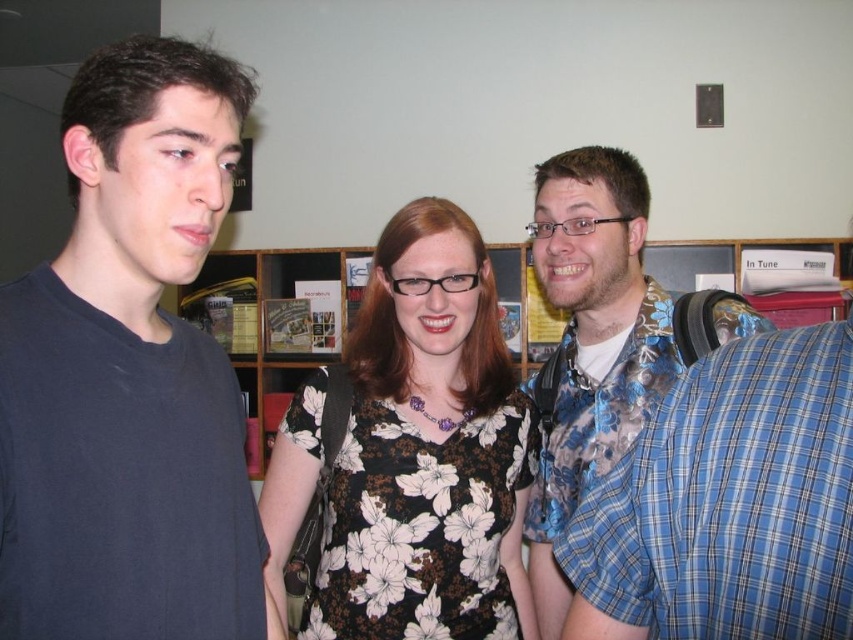
Question: Is dark blue t-shirt at left further to camera compared to floral fabric dress at center?

Choices:
 (A) yes
 (B) no

Answer: (B)

Question: Which of the following is the farthest from the observer?

Choices:
 (A) (581, 424)
 (B) (490, 451)
 (C) (109, 468)
 (D) (253, 372)

Answer: (D)

Question: Is floral fabric dress at center above floral shirt at right?

Choices:
 (A) yes
 (B) no

Answer: (B)

Question: Which object is closer to the camera taking this photo?

Choices:
 (A) wooden bookshelf at center
 (B) floral fabric dress at center

Answer: (B)

Question: Which object appears farthest from the camera in this image?

Choices:
 (A) wooden bookshelf at center
 (B) dark blue t-shirt at left
 (C) floral shirt at right
 (D) floral fabric dress at center

Answer: (A)

Question: Is floral fabric dress at center thinner than floral shirt at right?

Choices:
 (A) yes
 (B) no

Answer: (B)